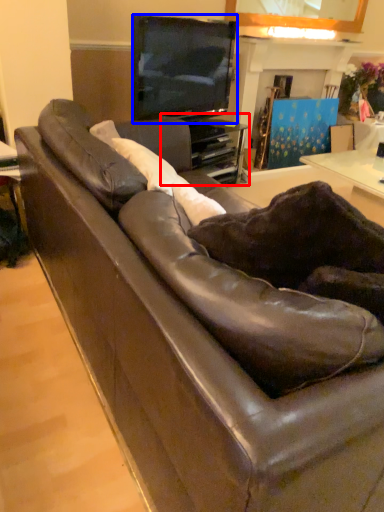
Question: Among these objects, which one is nearest to the camera, entertainment center (highlighted by a red box) or television (highlighted by a blue box)?

Choices:
 (A) entertainment center
 (B) television

Answer: (B)